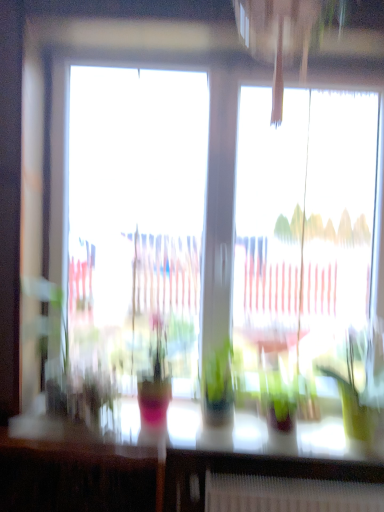
Question: Considering the relative positions of transparent glass window at center and translucent glass table at lower center in the image provided, is transparent glass window at center in front of translucent glass table at lower center?

Choices:
 (A) yes
 (B) no

Answer: (B)

Question: Is transparent glass window at center facing towards translucent glass table at lower center?

Choices:
 (A) no
 (B) yes

Answer: (B)

Question: Does transparent glass window at center appear on the left side of translucent glass table at lower center?

Choices:
 (A) yes
 (B) no

Answer: (B)

Question: Is transparent glass window at center shorter than translucent glass table at lower center?

Choices:
 (A) no
 (B) yes

Answer: (A)

Question: From a real-world perspective, does transparent glass window at center sit lower than translucent glass table at lower center?

Choices:
 (A) no
 (B) yes

Answer: (A)

Question: Is point (134, 408) closer or farther from the camera than point (218, 103)?

Choices:
 (A) closer
 (B) farther

Answer: (A)

Question: Looking at the image, does translucent glass table at lower center seem bigger or smaller compared to transparent glass window at center?

Choices:
 (A) small
 (B) big

Answer: (A)

Question: Which is correct: translucent glass table at lower center is inside transparent glass window at center, or outside of it?

Choices:
 (A) inside
 (B) outside

Answer: (B)

Question: Considering their positions, is translucent glass table at lower center located in front of or behind transparent glass window at center?

Choices:
 (A) behind
 (B) front

Answer: (B)

Question: Based on their sizes in the image, would you say green glossy houseplant at right is bigger or smaller than transparent glass window at center?

Choices:
 (A) small
 (B) big

Answer: (A)

Question: Considering the positions of point (332, 359) and point (147, 290), is point (332, 359) closer or farther from the camera than point (147, 290)?

Choices:
 (A) farther
 (B) closer

Answer: (B)

Question: Is green glossy houseplant at right to the left or to the right of transparent glass window at center in the image?

Choices:
 (A) left
 (B) right

Answer: (B)

Question: Considering the positions of green glossy houseplant at right and transparent glass window at center in the image, is green glossy houseplant at right taller or shorter than transparent glass window at center?

Choices:
 (A) tall
 (B) short

Answer: (B)

Question: Considering the positions of point (216, 86) and point (332, 375), is point (216, 86) closer or farther from the camera than point (332, 375)?

Choices:
 (A) farther
 (B) closer

Answer: (A)

Question: Would you say transparent glass window at center is to the left or to the right of green glossy houseplant at right in the picture?

Choices:
 (A) left
 (B) right

Answer: (A)